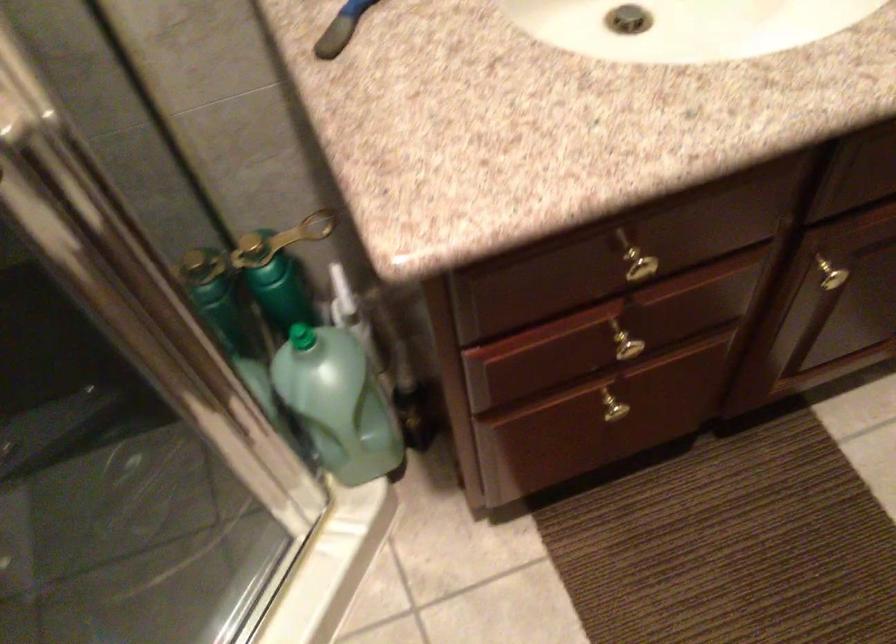
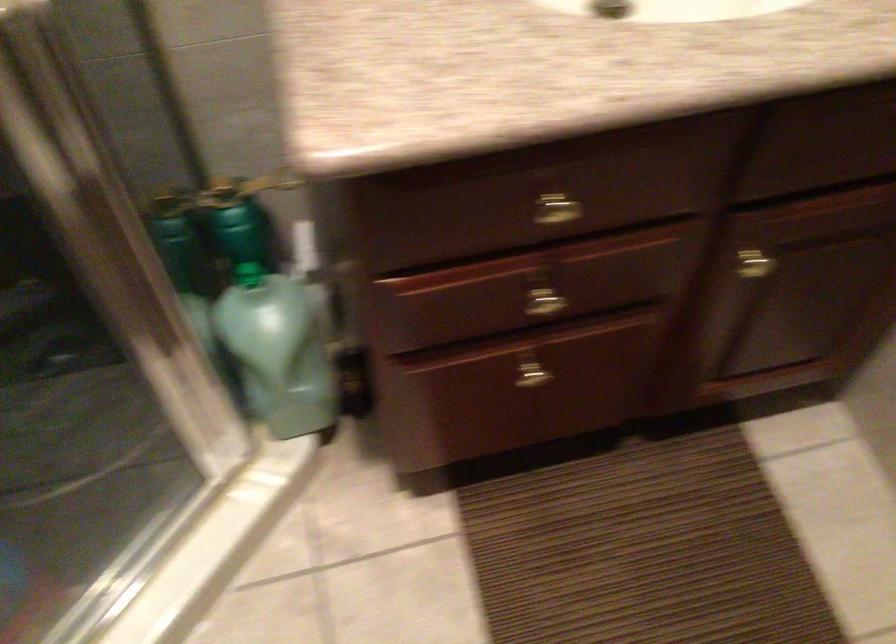
Question: The first image is from the beginning of the video and the second image is from the end. How did the camera likely rotate when shooting the video?

Choices:
 (A) Left
 (B) Right
 (C) Up
 (D) Down

Answer: (C)